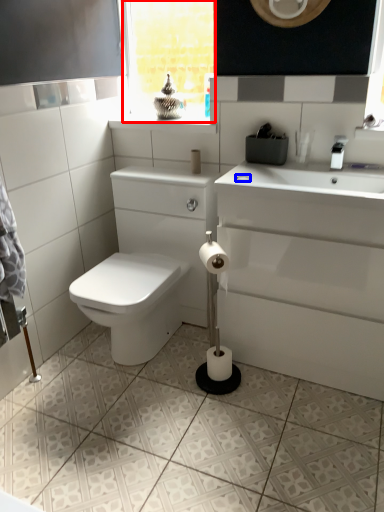
Question: Which point is closer to the camera, window frame (highlighted by a red box) or soap (highlighted by a blue box)?

Choices:
 (A) window frame
 (B) soap

Answer: (B)